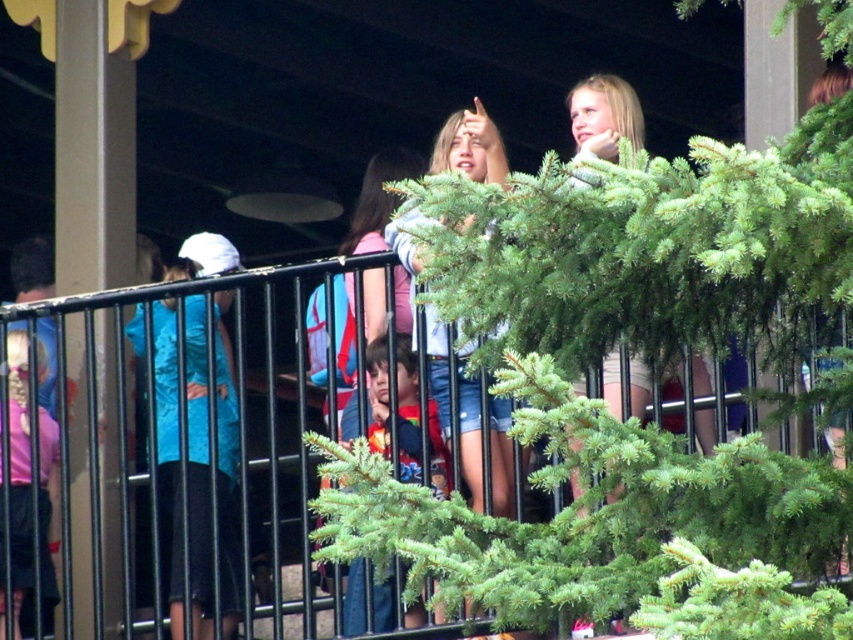
Question: Is black metal fence at upper center below blue fabric shirt at left?

Choices:
 (A) no
 (B) yes

Answer: (B)

Question: Can you confirm if black metal fence at upper center is thinner than red shirt at center?

Choices:
 (A) yes
 (B) no

Answer: (B)

Question: Which object is closer to the camera taking this photo?

Choices:
 (A) red shirt at center
 (B) blue fabric shirt at left
 (C) pink matte shorts at lower left
 (D) black metal fence at upper center

Answer: (D)

Question: Which of the following is the farthest from the observer?

Choices:
 (A) (169, 460)
 (B) (30, 564)
 (C) (373, 177)
 (D) (88, 416)

Answer: (C)

Question: Can you confirm if pink matte shorts at lower left is thinner than red shirt at center?

Choices:
 (A) no
 (B) yes

Answer: (B)

Question: Which point is closer to the camera?

Choices:
 (A) (386, 176)
 (B) (126, 422)
 (C) (430, 449)
 (D) (200, 468)

Answer: (C)